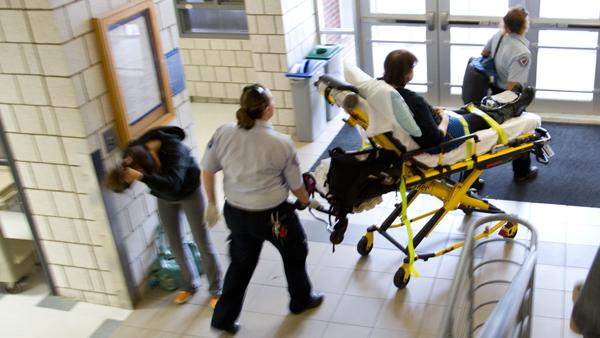
Identify the location of frame. (102, 31).